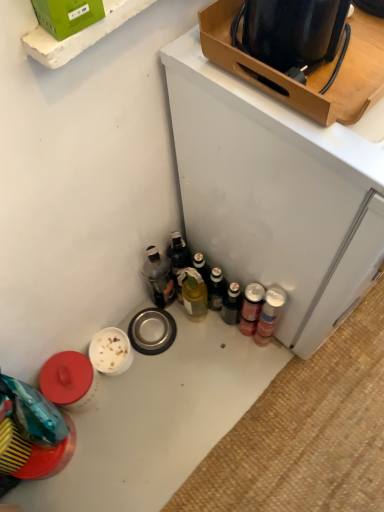
The width and height of the screenshot is (384, 512). Identify the location of vacant point to the right of metallic silver can at lower right. (319, 355).